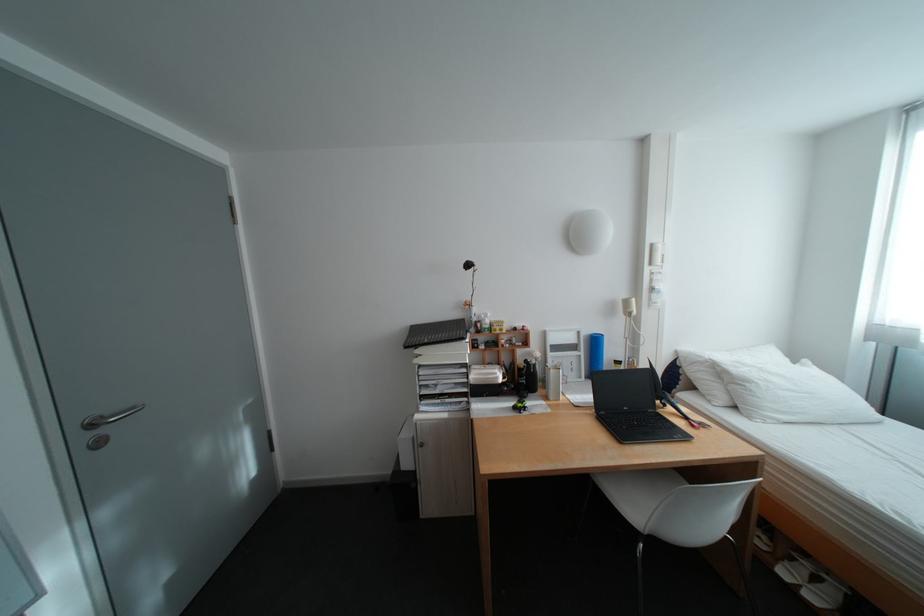
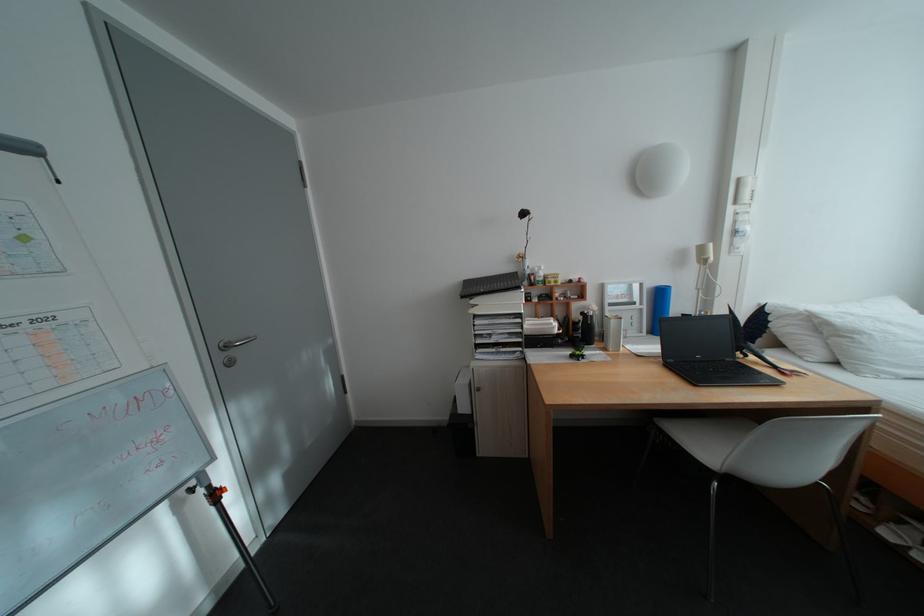
Locate, in the second image, the point that corresponds to the point at 594,354 in the first image.

(657, 307)